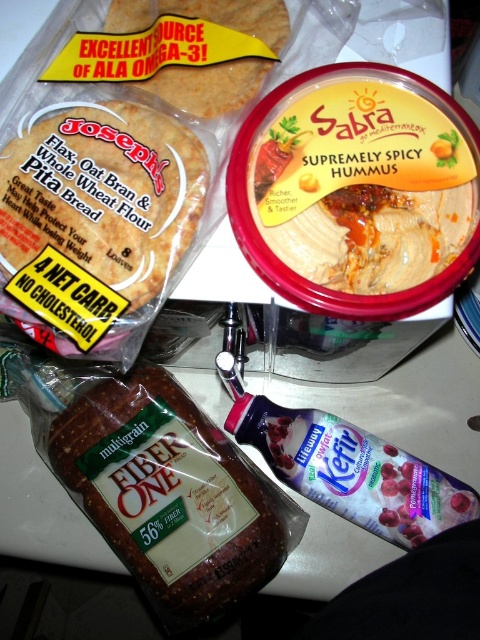
Question: Is brown multigrain fiber one at center to the right of matte brown pita bread at upper left from the viewer's perspective?

Choices:
 (A) yes
 (B) no

Answer: (B)

Question: Is brown multigrain fiber one at center in front of matte brown pita bread at upper left?

Choices:
 (A) yes
 (B) no

Answer: (B)

Question: Is brown multigrain fiber one at center thinner than golden brown pita bread at upper left?

Choices:
 (A) yes
 (B) no

Answer: (B)

Question: Which point is closer to the camera?

Choices:
 (A) (216, 22)
 (B) (131, 561)

Answer: (A)

Question: Based on their relative distances, which object is farther from the matte brown pita bread at upper left?

Choices:
 (A) brown multigrain fiber one at center
 (B) golden brown pita bread at upper left

Answer: (A)

Question: Which of these objects is positioned closest to the golden brown pita bread at upper left?

Choices:
 (A) brown multigrain fiber one at center
 (B) matte brown pita bread at upper left

Answer: (B)